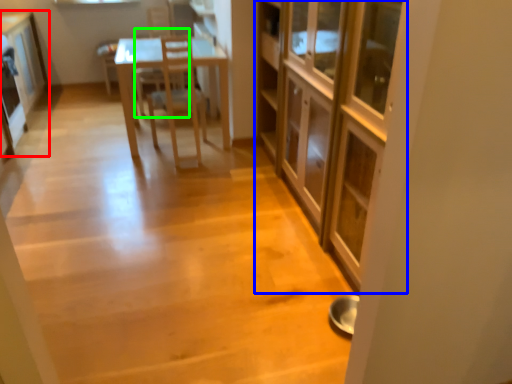
Question: Considering the real-world distances, which object is farthest from cabinetry (highlighted by a red box)? cabinetry (highlighted by a blue box) or armchair (highlighted by a green box)?

Choices:
 (A) cabinetry
 (B) armchair

Answer: (A)